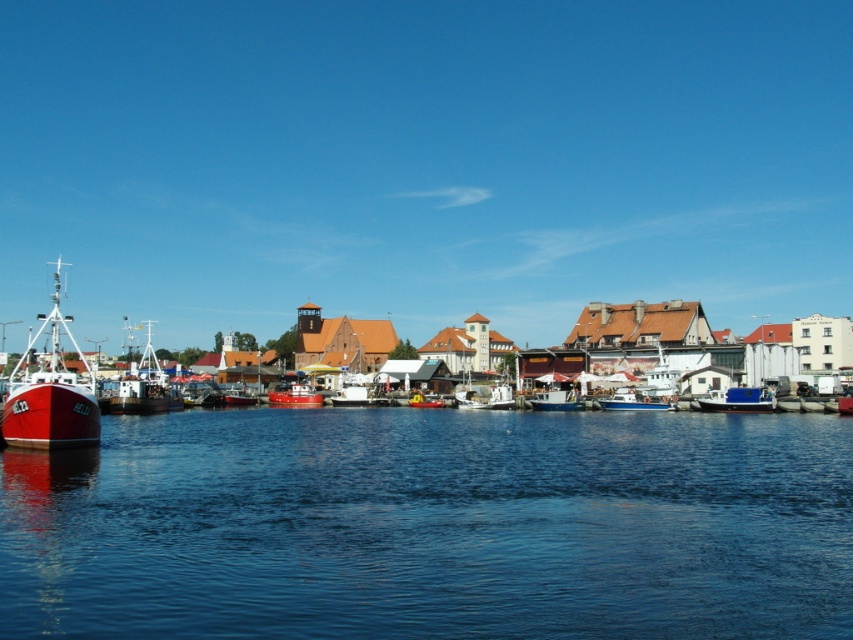
Question: Does white glossy boat at left appear on the right side of red rubber boat at center?

Choices:
 (A) yes
 (B) no

Answer: (B)

Question: Which point is closer to the camera?

Choices:
 (A) yellow rubber dinghy at center
 (B) blue matte boat at center
 (C) shiny red boat at left
 (D) white glossy boat at left

Answer: (C)

Question: Among these objects, which one is farthest from the camera?

Choices:
 (A) blue liquid water at lower center
 (B) white matte boat at center
 (C) white plastic boat at center
 (D) blue matte boat at right

Answer: (B)

Question: Is blue liquid water at lower center behind white glossy boat at left?

Choices:
 (A) no
 (B) yes

Answer: (A)

Question: Does blue liquid water at lower center appear on the right side of white glossy boat at left?

Choices:
 (A) yes
 (B) no

Answer: (A)

Question: Which object is positioned farthest from the white matte boat at center?

Choices:
 (A) red rubber boat at center
 (B) shiny red boat at left

Answer: (B)